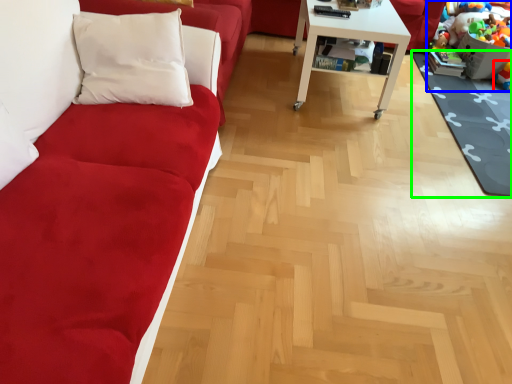
Question: Estimate the real-world distances between objects in this image. Which object is farther from toy (highlighted by a red box), toy (highlighted by a blue box) or mat (highlighted by a green box)?

Choices:
 (A) toy
 (B) mat

Answer: (B)